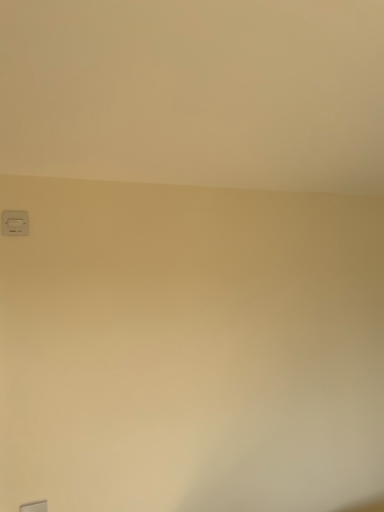
This screenshot has width=384, height=512. Describe the element at coordinates (15, 223) in the screenshot. I see `white plastic light switch at upper left` at that location.

In order to face white plastic light switch at upper left, should I rotate leftwards or rightwards?

A 22.534 degree turn to the left will do.

Locate an element on the screen. The height and width of the screenshot is (512, 384). white plastic light switch at upper left is located at coordinates (15, 223).

Image resolution: width=384 pixels, height=512 pixels. What do you see at coordinates (34, 506) in the screenshot? I see `transparent glass window at lower left` at bounding box center [34, 506].

What is the approximate height of transparent glass window at lower left?

transparent glass window at lower left is 4.22 inches in height.

From the picture: In order to face transparent glass window at lower left, should I rotate leftwards or rightwards?

Turn left by 20.474 degrees to look at transparent glass window at lower left.

You are a GUI agent. You are given a task and a screenshot of the screen. Output one action in this format:
    pyautogui.click(x=<x>, y=<y>)
    Task: Click on the transparent glass window at lower left
    The image size is (384, 512).
    Given the screenshot: What is the action you would take?
    pyautogui.click(x=34, y=506)

Find the location of a particular element. This screenshot has height=512, width=384. white plastic light switch at upper left is located at coordinates (15, 223).

Is transparent glass window at lower left to the right of white plastic light switch at upper left from the viewer's perspective?

Yes.

Is transparent glass window at lower left in front of white plastic light switch at upper left?

Yes, it is.

Which point is more distant from viewer, (23, 510) or (25, 227)?

Positioned behind is point (25, 227).

From the image's perspective, relative to white plastic light switch at upper left, is transparent glass window at lower left above or below?

transparent glass window at lower left is situated lower than white plastic light switch at upper left in the image.

From a real-world perspective, is transparent glass window at lower left positioned over white plastic light switch at upper left based on gravity?

No, from a real-world perspective, transparent glass window at lower left is not above white plastic light switch at upper left.

From the picture: Can you confirm if transparent glass window at lower left is wider than white plastic light switch at upper left?

No.

Considering the sizes of objects transparent glass window at lower left and white plastic light switch at upper left in the image provided, who is taller, transparent glass window at lower left or white plastic light switch at upper left?

With more height is white plastic light switch at upper left.

Can you confirm if transparent glass window at lower left is smaller than white plastic light switch at upper left?

Correct, transparent glass window at lower left occupies less space than white plastic light switch at upper left.

Is transparent glass window at lower left not within white plastic light switch at upper left?

Yes, transparent glass window at lower left is not within white plastic light switch at upper left.

Are transparent glass window at lower left and white plastic light switch at upper left far apart?

No.

Could you tell me if transparent glass window at lower left is facing white plastic light switch at upper left?

No, transparent glass window at lower left is not aimed at white plastic light switch at upper left.

What are the coordinates of `light switch that appears above the transparent glass window at lower left (from a real-world perspective)` in the screenshot? It's located at (15, 223).

Is white plastic light switch at upper left at the left side of transparent glass window at lower left?

Indeed, white plastic light switch at upper left is positioned on the left side of transparent glass window at lower left.

Considering the positions of objects white plastic light switch at upper left and transparent glass window at lower left in the image provided, who is in front, white plastic light switch at upper left or transparent glass window at lower left?

transparent glass window at lower left is in front.

Considering the points (24, 233) and (36, 506), which point is behind, point (24, 233) or point (36, 506)?

The point (24, 233) is more distant.

From the image's perspective, is white plastic light switch at upper left located above or below transparent glass window at lower left?

Clearly, from the image's perspective, white plastic light switch at upper left is above transparent glass window at lower left.

From a real-world perspective, is white plastic light switch at upper left positioned under transparent glass window at lower left based on gravity?

No, from a real-world perspective, white plastic light switch at upper left is not under transparent glass window at lower left.

Can you confirm if white plastic light switch at upper left is wider than transparent glass window at lower left?

Yes.

Can you confirm if white plastic light switch at upper left is shorter than transparent glass window at lower left?

No.

Is white plastic light switch at upper left smaller than transparent glass window at lower left?

Actually, white plastic light switch at upper left might be larger than transparent glass window at lower left.

Can transparent glass window at lower left be found inside white plastic light switch at upper left?

No, white plastic light switch at upper left does not contain transparent glass window at lower left.

Is white plastic light switch at upper left placed right next to transparent glass window at lower left?

No, white plastic light switch at upper left is not with transparent glass window at lower left.

Is white plastic light switch at upper left oriented towards transparent glass window at lower left?

No, white plastic light switch at upper left is not turned towards transparent glass window at lower left.

What's the angular difference between white plastic light switch at upper left and transparent glass window at lower left's facing directions?

The facing directions of white plastic light switch at upper left and transparent glass window at lower left are 2.54 degrees apart.

In the image, there is a white plastic light switch at upper left. Where is `window below it (from a real-world perspective)`? This screenshot has height=512, width=384. window below it (from a real-world perspective) is located at coordinates (34, 506).

At what (x,y) coordinates should I click in order to perform the action: click on window located in front of the white plastic light switch at upper left. Please return your answer as a coordinate pair (x, y). The height and width of the screenshot is (512, 384). Looking at the image, I should click on (34, 506).

I want to click on window on the right of white plastic light switch at upper left, so click(x=34, y=506).